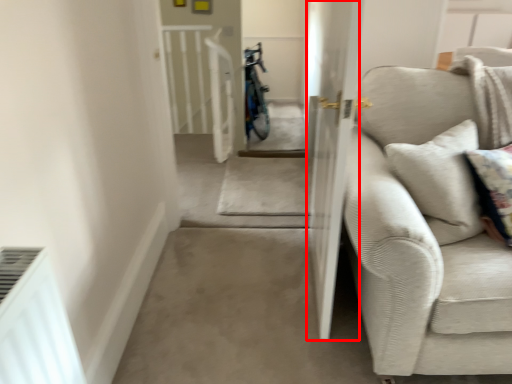
Question: From the image, what is the correct spatial relationship of screen door (annotated by the red box) in relation to studio couch?

Choices:
 (A) left
 (B) right

Answer: (A)